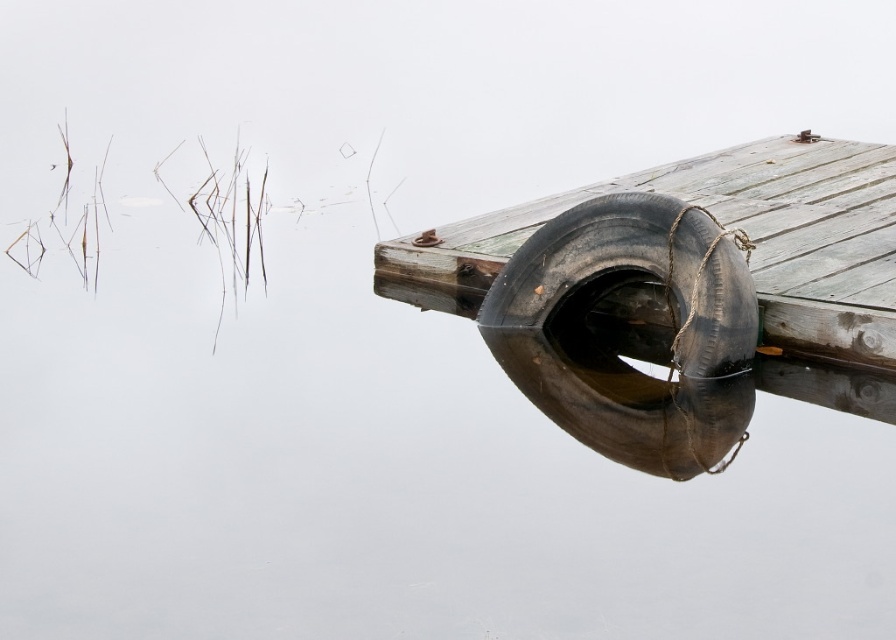
Question: Is the position of rubber tire at center more distant than that of black rubber tire at right?

Choices:
 (A) no
 (B) yes

Answer: (B)

Question: Does rubber tire at center appear over black rubber tire at right?

Choices:
 (A) yes
 (B) no

Answer: (B)

Question: Which object is farther from the camera taking this photo?

Choices:
 (A) rubber tire at center
 (B) black rubber tire at right

Answer: (A)

Question: Is rubber tire at center positioned before black rubber tire at right?

Choices:
 (A) yes
 (B) no

Answer: (B)